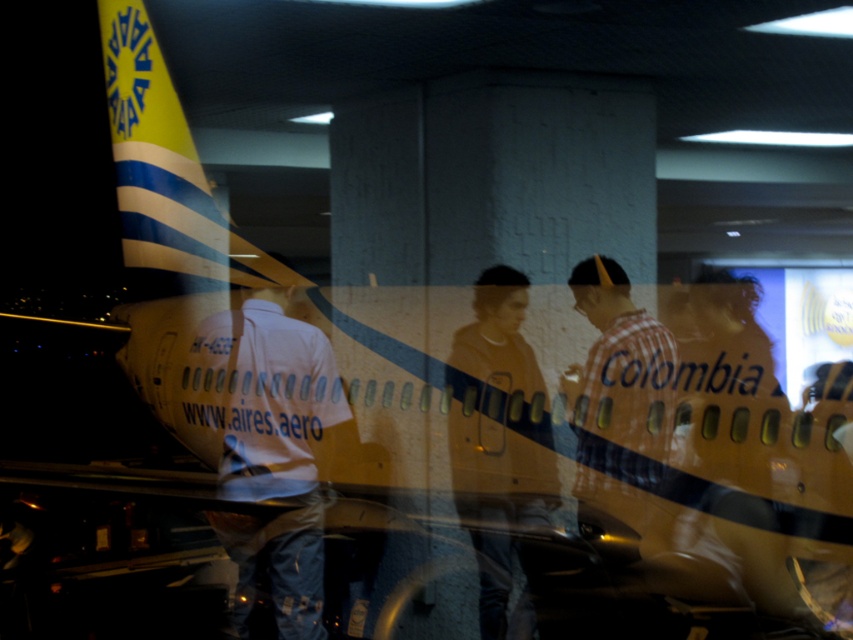
Question: Which point is closer to the camera taking this photo?

Choices:
 (A) (584, 282)
 (B) (482, 636)
 (C) (315, 502)

Answer: (A)

Question: Which point is closer to the camera?

Choices:
 (A) checkered fabric shirt at right
 (B) dark gray hoodie at center

Answer: (A)

Question: Does white shirt at center lie in front of checkered fabric shirt at right?

Choices:
 (A) no
 (B) yes

Answer: (A)

Question: Can you confirm if white shirt at center is wider than checkered fabric shirt at right?

Choices:
 (A) no
 (B) yes

Answer: (B)

Question: Which object appears farthest from the camera in this image?

Choices:
 (A) white shirt at center
 (B) dark gray hoodie at center

Answer: (A)

Question: Considering the relative positions of white shirt at center and dark gray hoodie at center in the image provided, where is white shirt at center located with respect to dark gray hoodie at center?

Choices:
 (A) above
 (B) below

Answer: (B)